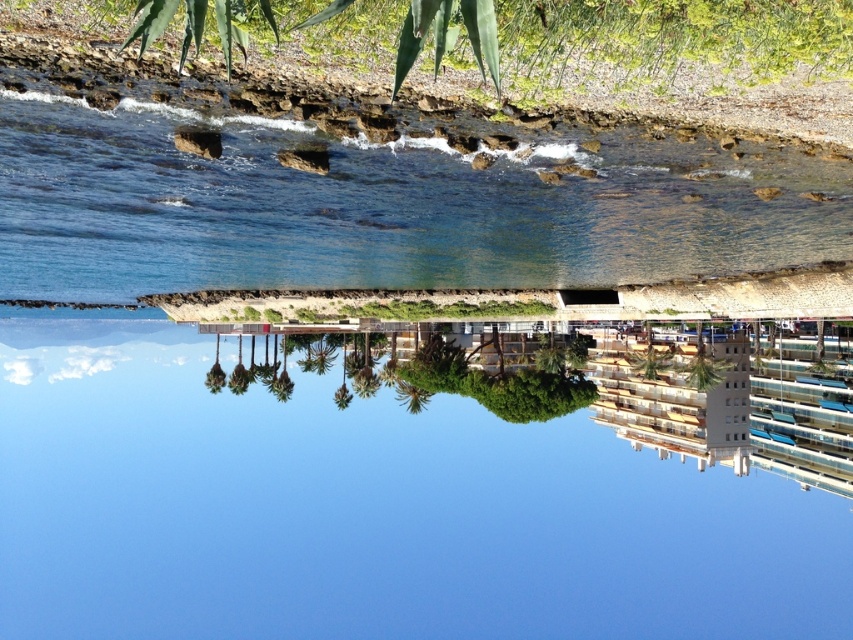
Is blue glass river at center to the right of clear blue water at center from the viewer's perspective?

Incorrect, blue glass river at center is not on the right side of clear blue water at center.

Which of these two, blue glass river at center or clear blue water at center, stands shorter?

clear blue water at center is shorter.

What are the coordinates of `blue glass river at center` in the screenshot? It's located at (367, 504).

Where is `blue glass river at center`? blue glass river at center is located at coordinates (367, 504).